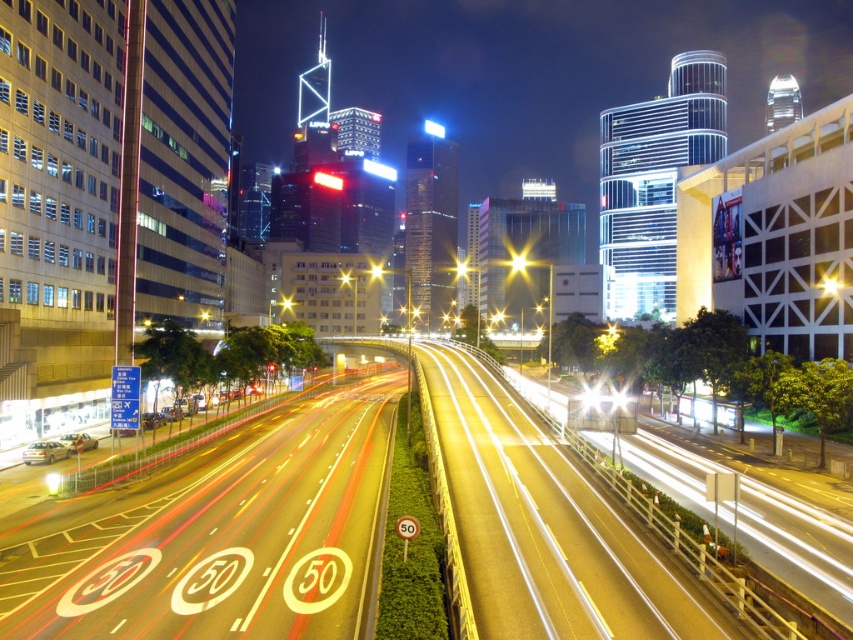
You are standing at the edge of the road in the foreground of the image. You see a point labeled as point (518, 262). What color is the object at this point?

The point (518, 262) corresponds to a bright yellow light at center.

You are a drone operator planning to capture a photo of the white glossy highway at center. According to the coordinates provided, where exactly should the drone focus to ensure the highway is the main subject?

The white glossy highway at center is located at point [224,538], so the drone should focus its camera on that coordinate to make the highway the main subject.

You are standing at the edge of the scene and want to cross the white glossy highway at center. According to the distance provided, is it safe to cross the highway if you can walk 20 meters in 10 seconds?

The white glossy highway at center is 17.26 meters away from the viewer. Since you can walk 20 meters in 10 seconds, you can easily cover the 17.26 meters in less than 10 seconds, making it safe to cross.